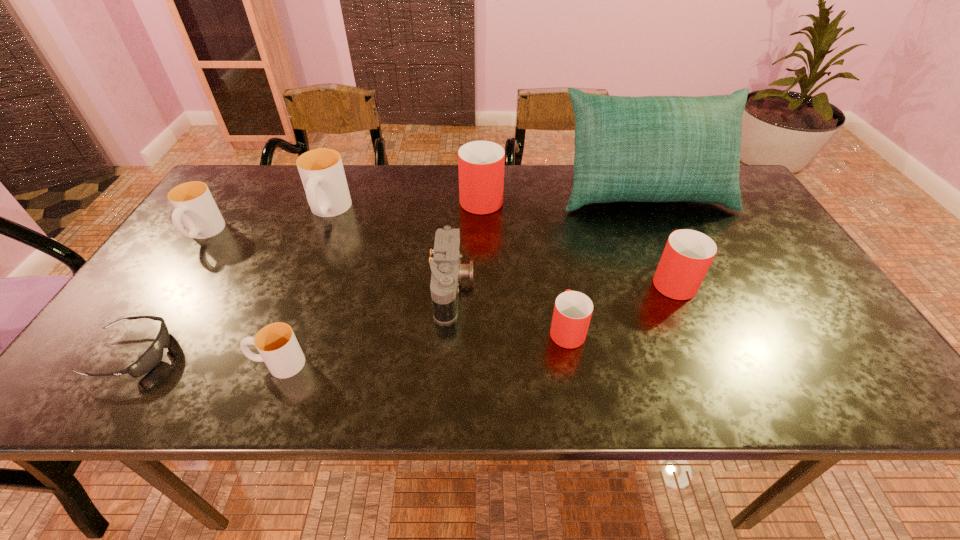
You are a GUI agent. You are given a task and a screenshot of the screen. Output one action in this format:
    pyautogui.click(x=<x>, y=<y>)
    Task: Click on the blank space at the right edge of the desktop
    The width and height of the screenshot is (960, 540).
    Given the screenshot: What is the action you would take?
    pyautogui.click(x=781, y=268)

Identify the location of vacant space at the far left corner. (254, 205).

Identify the location of free area in between the nearest yellow cup and the nearest red cup. (422, 346).

Identify the location of free space that is in between the rightmost red cup and the second nearest cup. (619, 304).

The width and height of the screenshot is (960, 540). What are the coordinates of `vacant region between the nearest cup and the biggest yellow cup` in the screenshot? It's located at (303, 288).

This screenshot has width=960, height=540. In order to click on vacant space in between the biggest yellow cup and the second biggest yellow cup in this screenshot , I will do `click(266, 222)`.

Locate an element on the screen. The width and height of the screenshot is (960, 540). free space between the second biggest yellow cup and the biggest yellow cup is located at coordinates (266, 222).

Identify the location of empty space that is in between the rightmost red cup and the shortest object. click(x=402, y=316).

What are the coordinates of `free space between the biggest yellow cup and the second biggest yellow cup` in the screenshot? It's located at 266,222.

Locate an element on the screen. unoccupied area between the second biggest yellow cup and the shortest object is located at coordinates (168, 294).